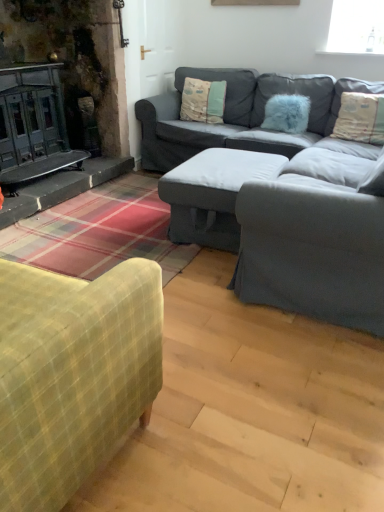
Question: Is textured gray armchair at center to the left of fluffy cream pillow at upper right, which appears as the 1th pillow when viewed from the right, from the viewer's perspective?

Choices:
 (A) yes
 (B) no

Answer: (A)

Question: Can you confirm if textured gray armchair at center is bigger than fluffy cream pillow at upper right, which appears as the 1th pillow when viewed from the right?

Choices:
 (A) no
 (B) yes

Answer: (B)

Question: Is textured gray armchair at center wider than fluffy cream pillow at upper right, the third pillow positioned from the left?

Choices:
 (A) no
 (B) yes

Answer: (B)

Question: Is textured gray armchair at center positioned far away from fluffy cream pillow at upper right, which appears as the 1th pillow when viewed from the right?

Choices:
 (A) yes
 (B) no

Answer: (A)

Question: Is textured gray armchair at center thinner than fluffy cream pillow at upper right, the third pillow positioned from the left?

Choices:
 (A) no
 (B) yes

Answer: (A)

Question: Is textured gray armchair at center not inside fluffy cream pillow at upper right, which appears as the 1th pillow when viewed from the right?

Choices:
 (A) no
 (B) yes

Answer: (B)

Question: Considering the relative sizes of textured gray armchair at center and white fabric ottoman at center in the image provided, is textured gray armchair at center bigger than white fabric ottoman at center?

Choices:
 (A) no
 (B) yes

Answer: (B)

Question: Is textured gray armchair at center with white fabric ottoman at center?

Choices:
 (A) no
 (B) yes

Answer: (A)

Question: From the image's perspective, would you say textured gray armchair at center is shown under white fabric ottoman at center?

Choices:
 (A) yes
 (B) no

Answer: (A)

Question: Is textured gray armchair at center oriented away from white fabric ottoman at center?

Choices:
 (A) yes
 (B) no

Answer: (B)

Question: Is textured gray armchair at center oriented towards white fabric ottoman at center?

Choices:
 (A) no
 (B) yes

Answer: (B)

Question: Does textured gray armchair at center appear on the right side of white fabric ottoman at center?

Choices:
 (A) no
 (B) yes

Answer: (B)

Question: Considering the relative sizes of dark gray fabric couch at center and fluffy cream pillow at upper right, which appears as the 1th pillow when viewed from the right, in the image provided, is dark gray fabric couch at center bigger than fluffy cream pillow at upper right, which appears as the 1th pillow when viewed from the right,?

Choices:
 (A) no
 (B) yes

Answer: (B)